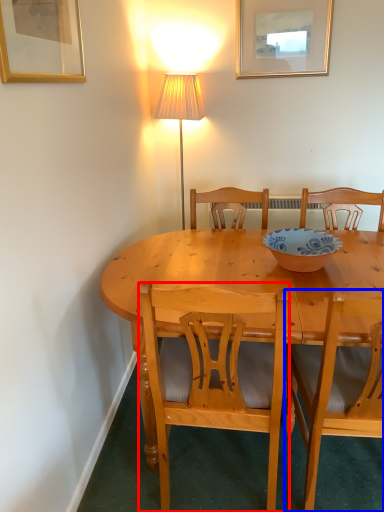
Question: Which of the following is the closest to the observer, chair (highlighted by a red box) or chair (highlighted by a blue box)?

Choices:
 (A) chair
 (B) chair

Answer: (B)